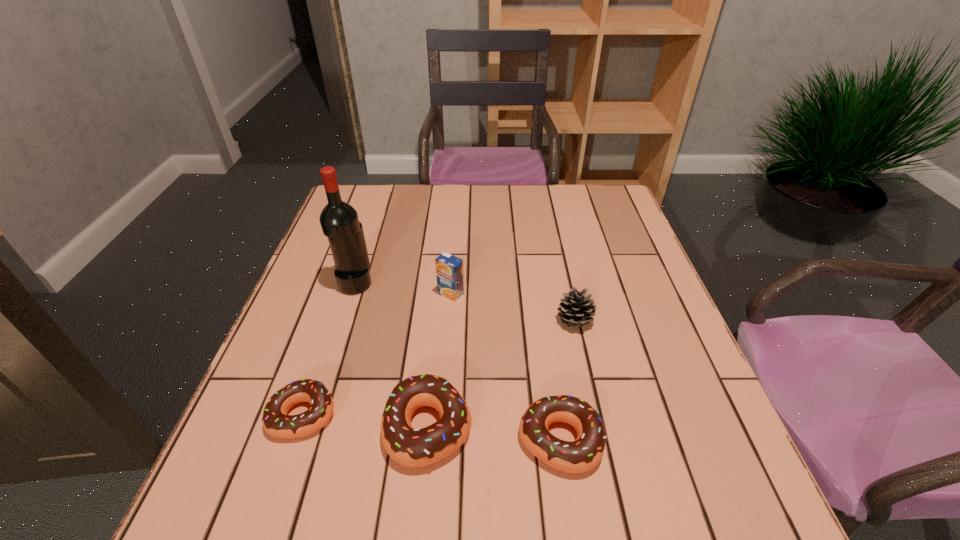
In order to click on free location at the left edge of the desktop in this screenshot , I will do pyautogui.click(x=301, y=342).

In the image, there is a desktop. Find the location of `vacant space at the right edge`. vacant space at the right edge is located at coordinates click(x=628, y=258).

In the image, there is a desktop. Where is `free space at the far right corner`? This screenshot has height=540, width=960. free space at the far right corner is located at coordinates (584, 215).

Locate an element on the screen. blank space at the near right corner of the desktop is located at coordinates (721, 421).

Find the location of a particular element. The height and width of the screenshot is (540, 960). vacant point located between the second doughnut from right to left and the tallest object is located at coordinates (392, 355).

Identify the location of vacant area that lies between the rightmost doughnut and the second doughnut from left to right. 493,434.

The height and width of the screenshot is (540, 960). Find the location of `free space between the third farthest object and the second tallest doughnut`. free space between the third farthest object and the second tallest doughnut is located at coordinates (567, 381).

Locate an element on the screen. Image resolution: width=960 pixels, height=540 pixels. vacant region between the third farthest object and the fifth tallest object is located at coordinates (567, 381).

I want to click on free space between the second doughnut from left to right and the third tallest object, so click(x=502, y=374).

Where is `vacant space that's between the second doughnut from left to right and the second tallest doughnut`? This screenshot has width=960, height=540. vacant space that's between the second doughnut from left to right and the second tallest doughnut is located at coordinates (493, 434).